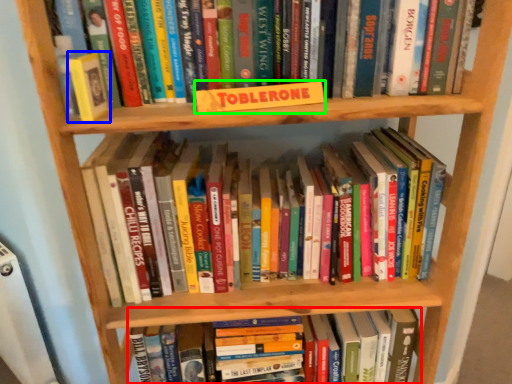
Question: Based on their relative distances, which object is nearer to book (highlighted by a red box)? Choose from paperback book (highlighted by a blue box) and paperback book (highlighted by a green box).

Choices:
 (A) paperback book
 (B) paperback book

Answer: (B)